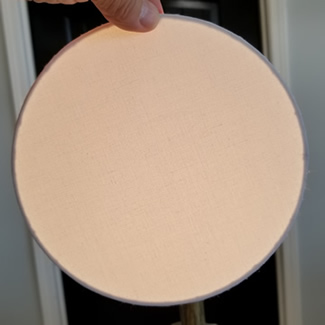
At what (x,y) coordinates should I click in order to perform the action: click on light gray painted walls. Please return your answer as a coordinate pair (x, y). The height and width of the screenshot is (325, 325). Looking at the image, I should click on (15, 230), (313, 118).